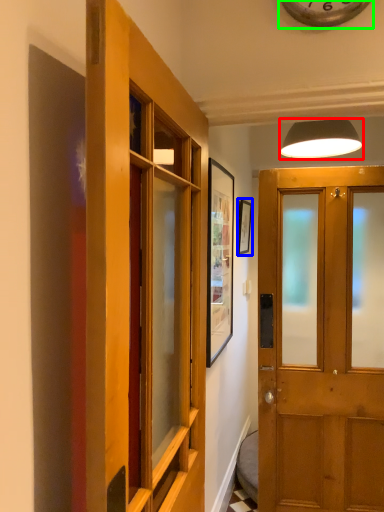
Question: Which is nearer to the lamp (highlighted by a red box)? picture frame (highlighted by a blue box) or clock (highlighted by a green box).

Choices:
 (A) picture frame
 (B) clock

Answer: (A)